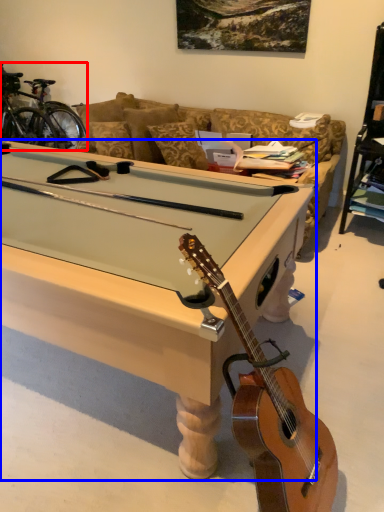
Question: Which object appears closest to the camera in this image, bicycle (highlighted by a red box) or desk (highlighted by a blue box)?

Choices:
 (A) bicycle
 (B) desk

Answer: (B)